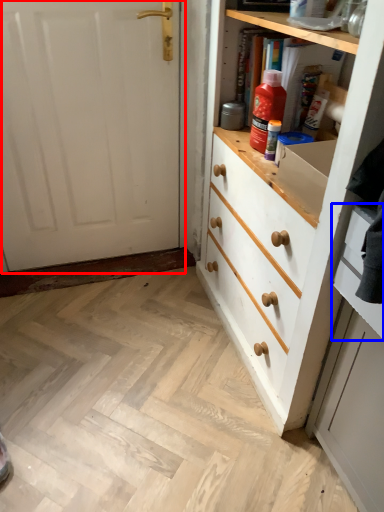
Question: Among these objects, which one is farthest to the camera, door (highlighted by a red box) or drawer (highlighted by a blue box)?

Choices:
 (A) door
 (B) drawer

Answer: (A)